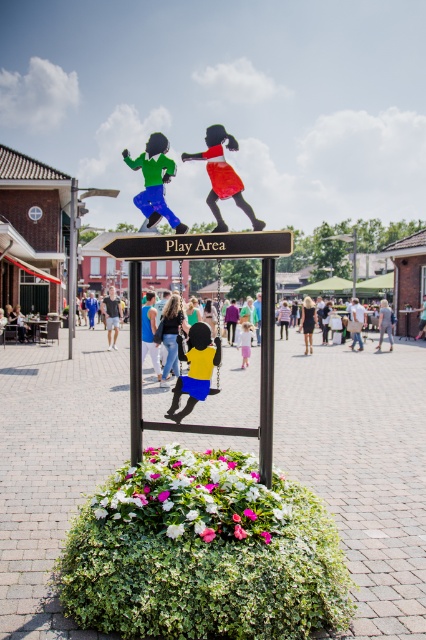
Can you confirm if brushed metal pole at left is taller than dark brown leather jacket at center?

Yes, brushed metal pole at left is taller than dark brown leather jacket at center.

What do you see at coordinates (71, 266) in the screenshot? I see `brushed metal pole at left` at bounding box center [71, 266].

At what (x,y) coordinates should I click in order to perform the action: click on brushed metal pole at left. Please return your answer as a coordinate pair (x, y). The image size is (426, 640). Looking at the image, I should click on (71, 266).

Which of these two, black plastic sign at center or brushed metal pole at center, stands shorter?

Standing shorter between the two is brushed metal pole at center.

Is point (178, 424) farther from viewer compared to point (131, 365)?

No, it is not.

Is point (265, 360) farther from camera compared to point (135, 353)?

No, it is not.

Image resolution: width=426 pixels, height=640 pixels. Find the location of `black plastic sign at center`. black plastic sign at center is located at coordinates (262, 330).

Between matte green fabric at upper center and brushed metal pole at left, which one is positioned lower?

matte green fabric at upper center

Measure the distance between matte green fabric at upper center and camera.

13.23 feet

Is point (155, 202) in front of point (74, 193)?

Yes, it is.

What are the coordinates of `matte green fabric at upper center` in the screenshot? It's located at pos(155,180).